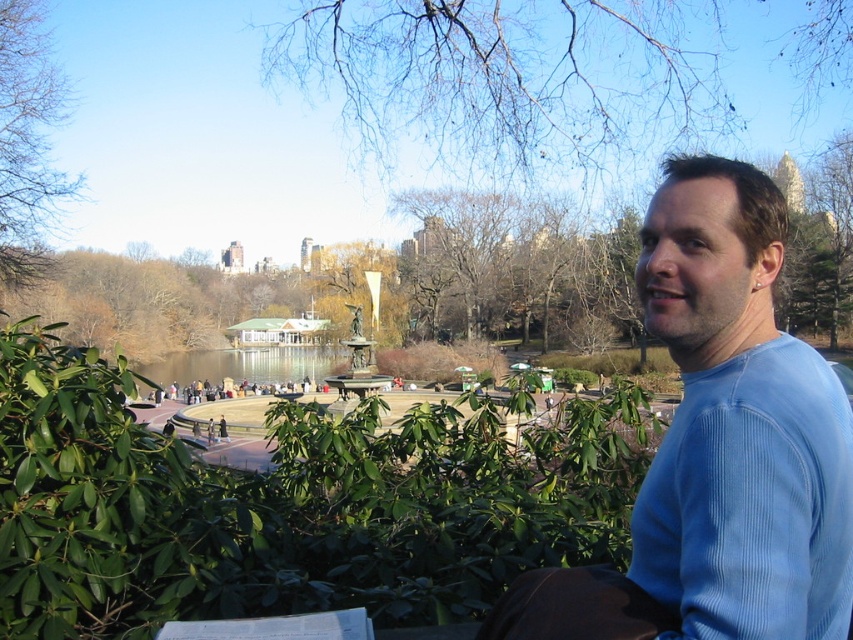
Question: Which point is farther from the camera taking this photo?

Choices:
 (A) (258, 376)
 (B) (44, 120)
 (C) (381, 113)
 (D) (694, 627)

Answer: (A)

Question: Is bare branches at upper center wider than clear water at center?

Choices:
 (A) no
 (B) yes

Answer: (B)

Question: Does bare branches at upper center have a smaller size compared to bare branches at upper left?

Choices:
 (A) yes
 (B) no

Answer: (B)

Question: Does blue ribbed sweater at right have a greater width compared to bare branches at upper left?

Choices:
 (A) no
 (B) yes

Answer: (A)

Question: Which object is positioned farthest from the blue ribbed sweater at right?

Choices:
 (A) clear water at center
 (B) bare branches at upper center
 (C) bare branches at upper left

Answer: (A)

Question: Among these points, which one is nearest to the camera?

Choices:
 (A) (9, 227)
 (B) (614, 593)
 (C) (160, 364)

Answer: (B)